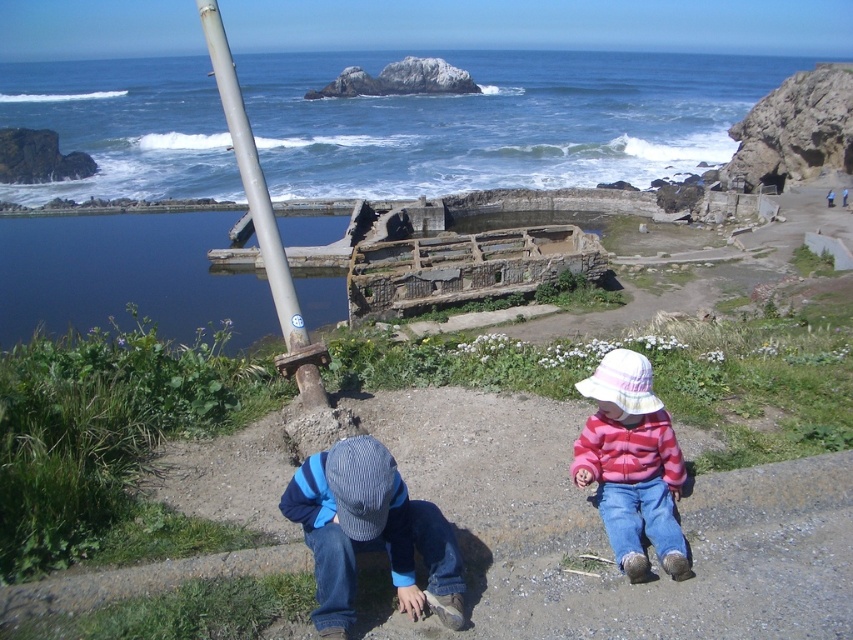
You are a photographer trying to capture a photo of the silver metallic pole at upper left without the blue denim jeans at lower center appearing in the foreground. Is this possible given their positions?

The blue denim jeans at lower center is positioned under the silver metallic pole at upper left, so the pole is above the jeans. By angling the camera upwards, you can capture the pole without the jeans in the foreground.

You are standing at the edge of the rocky area overlooking the ocean. There are two points marked in the scene. Which point, point (343, 541) or point (679, 451), is closer to you?

Point (343, 541) is closer to you than point (679, 451).